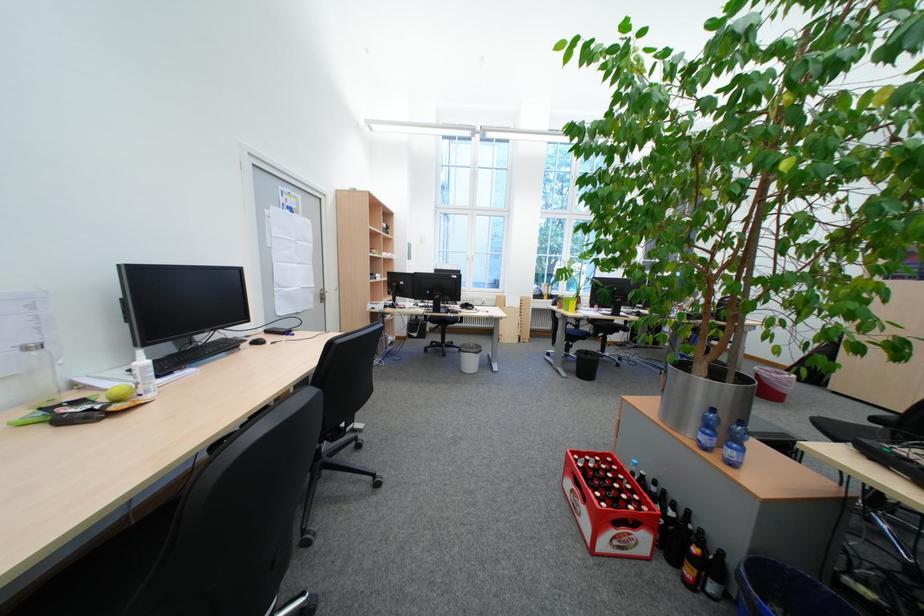
The height and width of the screenshot is (616, 924). Find the location of `black computer mouse`. black computer mouse is located at coordinates (257, 341).